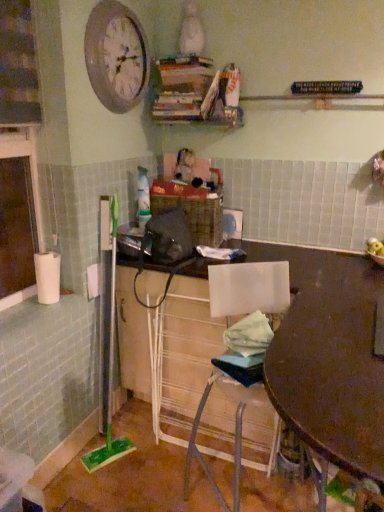
Locate an element on the screen. vacant area on top of matte brown desk at center (from a real-world perspective) is located at coordinates (302, 262).